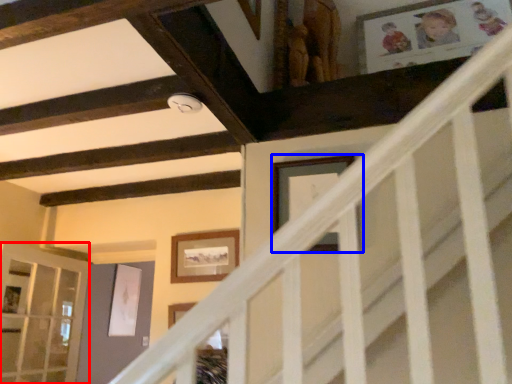
Question: Which of the following is the closest to the observer, glass door (highlighted by a red box) or picture frame (highlighted by a blue box)?

Choices:
 (A) glass door
 (B) picture frame

Answer: (B)